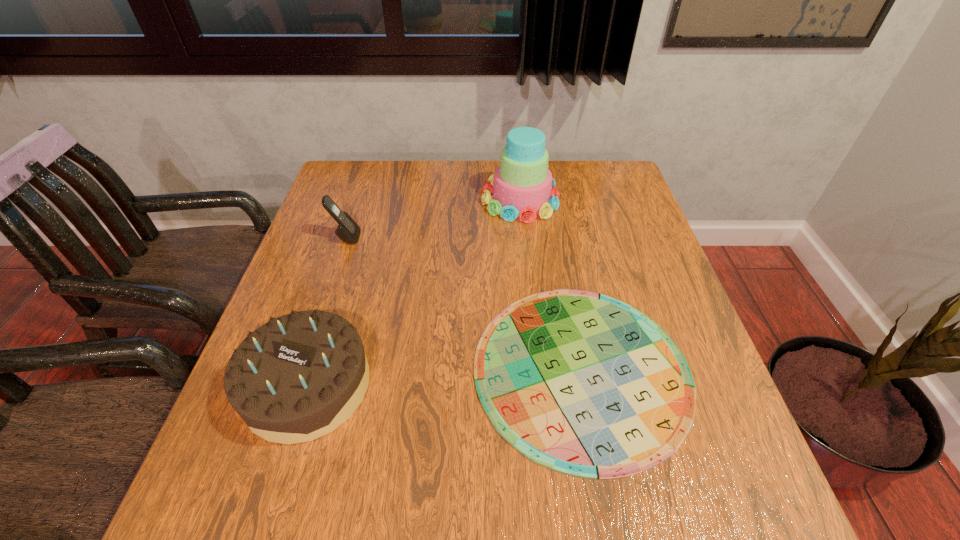
I want to click on object that is the second closest one to the shortest object, so click(523, 186).

The height and width of the screenshot is (540, 960). What are the coordinates of `vacant space that satisfies the following two spatial constraints: 1. on the front-facing side of the shortest object; 2. on the right side of the second farthest object` in the screenshot? It's located at (302, 369).

You are a GUI agent. You are given a task and a screenshot of the screen. Output one action in this format:
    pyautogui.click(x=<x>, y=<y>)
    Task: Click on the vacant area in the image that satisfies the following two spatial constraints: 1. on the front side of the cake; 2. on the front-facing side of the cellular telephone
    
    Given the screenshot: What is the action you would take?
    pyautogui.click(x=524, y=238)

The image size is (960, 540). I want to click on free spot that satisfies the following two spatial constraints: 1. on the front-facing side of the shortest object; 2. on the left side of the cellular telephone, so click(302, 369).

Where is `vacant point that satisfies the following two spatial constraints: 1. on the front-facing side of the cellular telephone; 2. on the back side of the gameboard`? Image resolution: width=960 pixels, height=540 pixels. vacant point that satisfies the following two spatial constraints: 1. on the front-facing side of the cellular telephone; 2. on the back side of the gameboard is located at coordinates (302, 369).